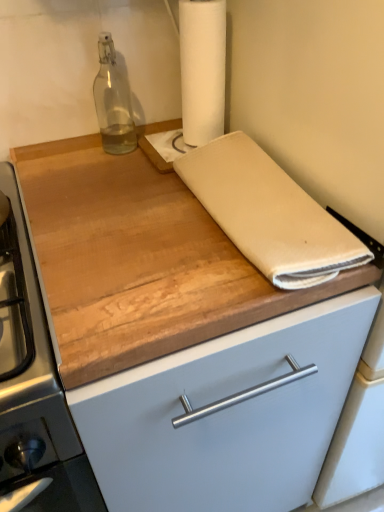
What are the coordinates of `free space to the left of beige cotton towel at center` in the screenshot? It's located at (115, 220).